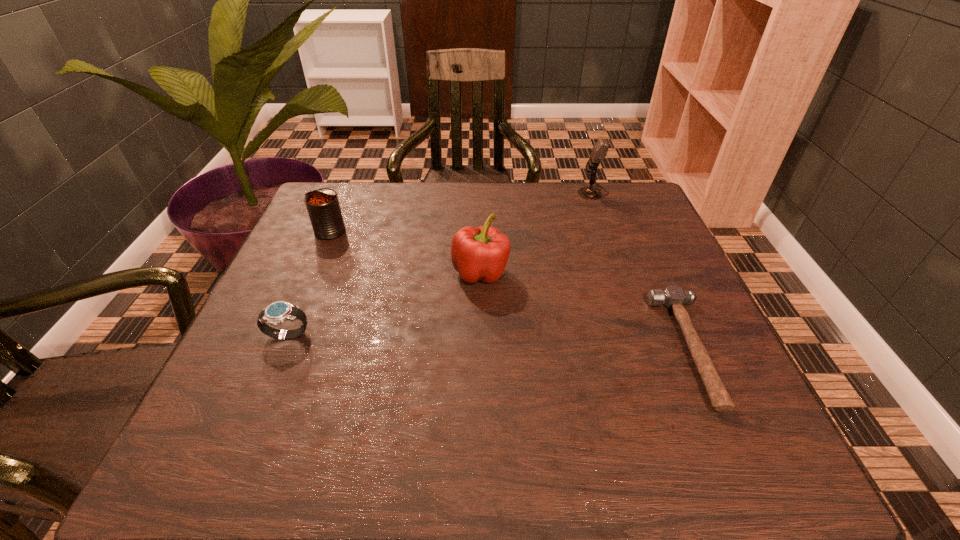
The image size is (960, 540). I want to click on vacant area that lies between the second farthest object and the microphone, so click(462, 212).

Locate an element on the screen. The height and width of the screenshot is (540, 960). empty space between the third object from left to right and the second farthest object is located at coordinates 405,252.

Find the location of a particular element. vacant space in between the can and the hammer is located at coordinates (510, 290).

Locate an element on the screen. This screenshot has width=960, height=540. free space that is in between the third object from right to left and the can is located at coordinates 405,252.

Where is `free space between the second farthest object and the bell pepper`? The image size is (960, 540). free space between the second farthest object and the bell pepper is located at coordinates (405, 252).

Where is `free space between the hammer and the microphone`? free space between the hammer and the microphone is located at coordinates (641, 270).

This screenshot has height=540, width=960. I want to click on vacant region between the third farthest object and the second shortest object, so click(384, 305).

You are a GUI agent. You are given a task and a screenshot of the screen. Output one action in this format:
    pyautogui.click(x=<x>, y=<y>)
    Task: Click on the vacant area that lies between the tallest object and the watch
    This screenshot has height=540, width=960.
    Given the screenshot: What is the action you would take?
    pyautogui.click(x=441, y=264)

In order to click on vacant point located between the watch and the farthest object in this screenshot , I will do `click(441, 264)`.

Select which object is the second closest to the third farthest object. Please provide its 2D coordinates. Your answer should be formatted as a tuple, i.e. [(x, y)], where the tuple contains the x and y coordinates of a point satisfying the conditions above.

[(278, 312)]